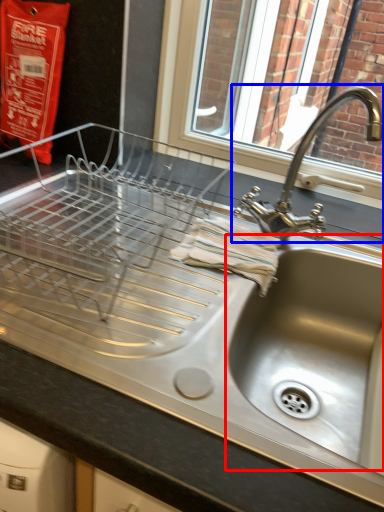
Question: Among these objects, which one is nearest to the camera, sink (highlighted by a red box) or tap (highlighted by a blue box)?

Choices:
 (A) sink
 (B) tap

Answer: (A)